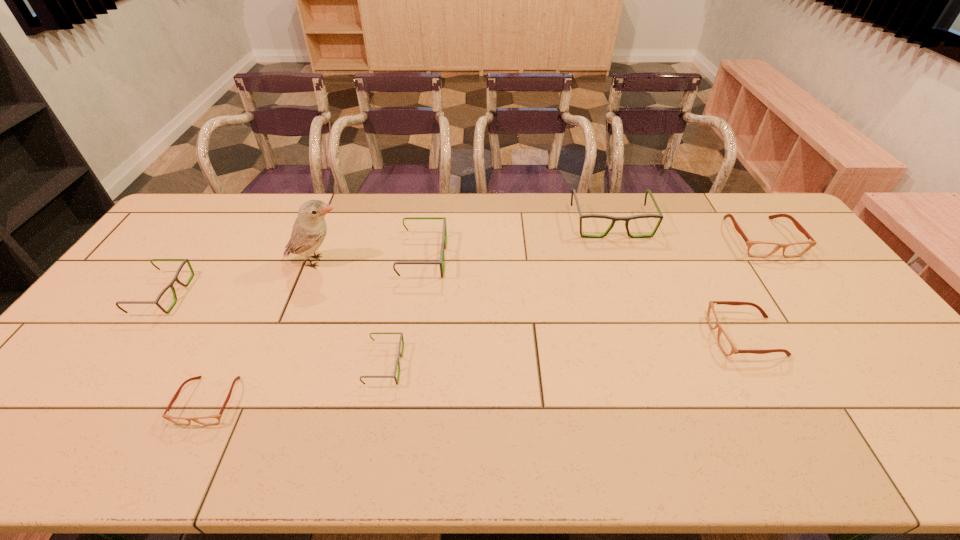
In the image, there is a desktop. Identify the location of vacant area at the left edge. (159, 240).

The width and height of the screenshot is (960, 540). In the image, there is a desktop. Identify the location of vacant space at the right edge. 826,307.

Locate an element on the screen. Image resolution: width=960 pixels, height=540 pixels. free spot at the far left corner of the desktop is located at coordinates (215, 215).

What are the coordinates of `blank space at the far right corner of the desktop` in the screenshot? It's located at (758, 220).

You are a GUI agent. You are given a task and a screenshot of the screen. Output one action in this format:
    pyautogui.click(x=<x>, y=<y>)
    Task: Click on the vacant point located between the tallest object and the rightmost spectacles
    
    Given the screenshot: What is the action you would take?
    pyautogui.click(x=539, y=249)

The image size is (960, 540). I want to click on free space between the nearest black spectacles and the tallest object, so click(350, 313).

This screenshot has width=960, height=540. Identify the location of unoccupied position between the smallest black spectacles and the tallest spectacles. (497, 294).

Where is `blank region between the second nearest brown spectacles and the second biggest black spectacles`? blank region between the second nearest brown spectacles and the second biggest black spectacles is located at coordinates (584, 296).

The height and width of the screenshot is (540, 960). What are the coordinates of `free space between the leftmost spectacles and the biggest brown spectacles` in the screenshot? It's located at (462, 266).

Find the location of `vacant area between the bird and the smallest black spectacles`. vacant area between the bird and the smallest black spectacles is located at coordinates (350, 313).